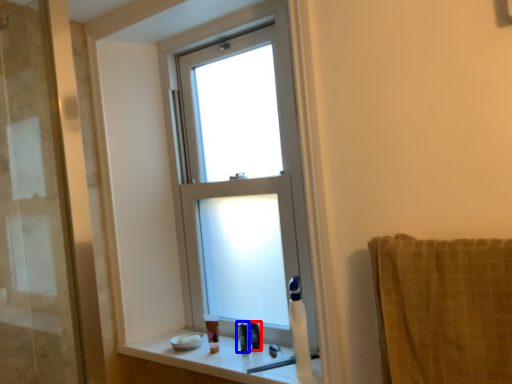
Question: Which object is further to the camera taking this photo, toiletry (highlighted by a red box) or toiletry (highlighted by a blue box)?

Choices:
 (A) toiletry
 (B) toiletry

Answer: (A)